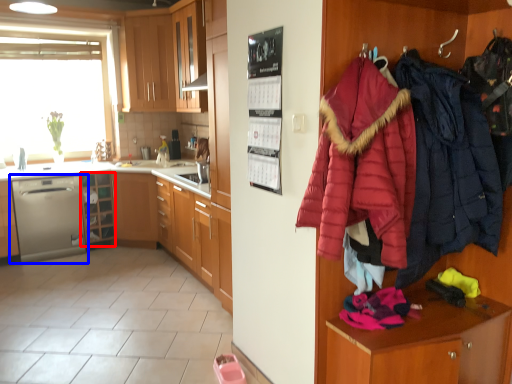
Question: Which of the following is the closest to the observer, shelf (highlighted by a red box) or dishwasher (highlighted by a blue box)?

Choices:
 (A) shelf
 (B) dishwasher

Answer: (B)